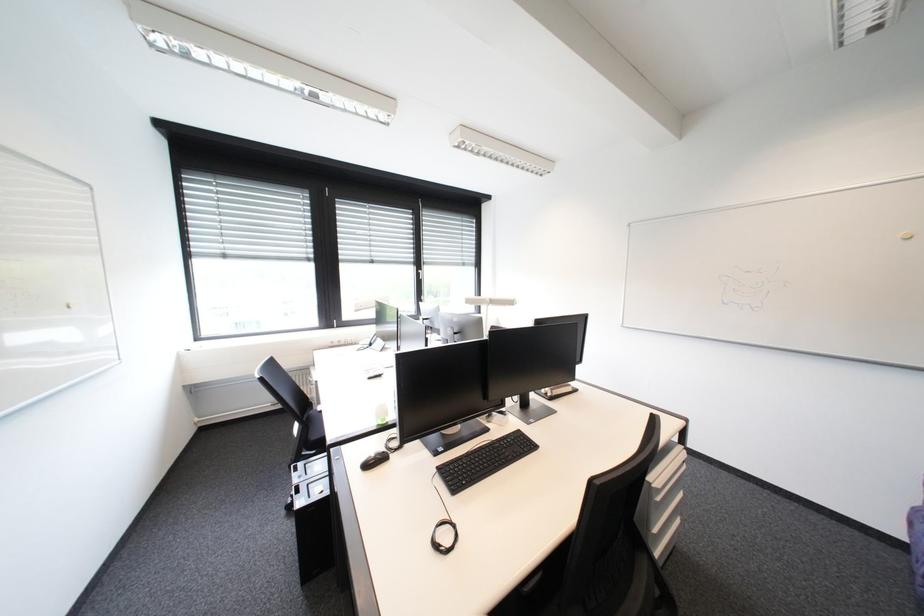
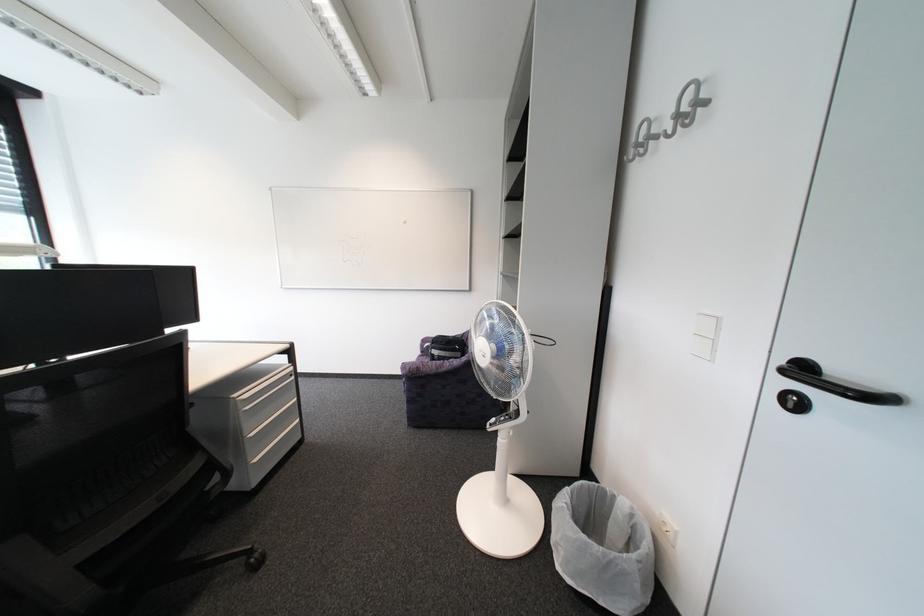
Question: The first image is from the beginning of the video and the second image is from the end. How did the camera likely rotate when shooting the video?

Choices:
 (A) Left
 (B) Right
 (C) Up
 (D) Down

Answer: (B)